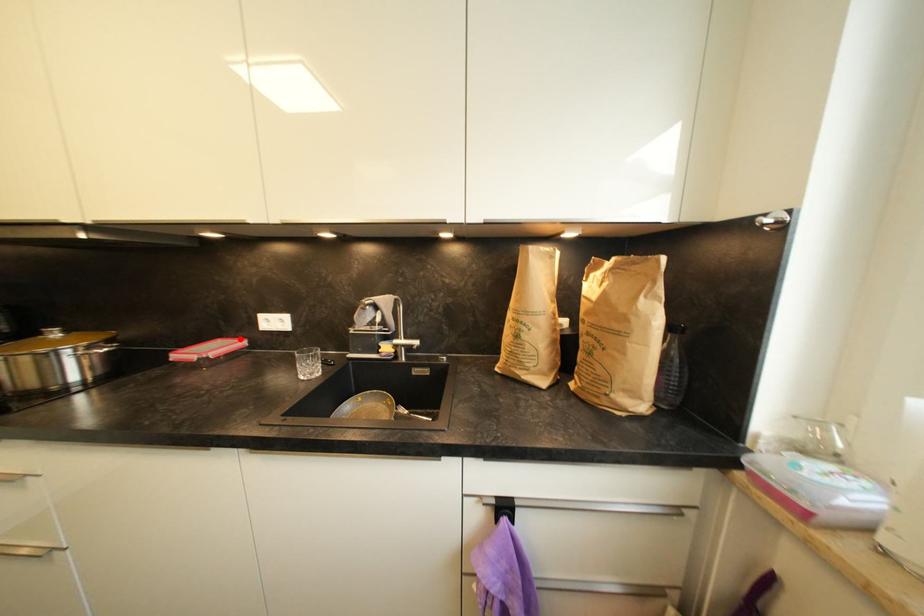
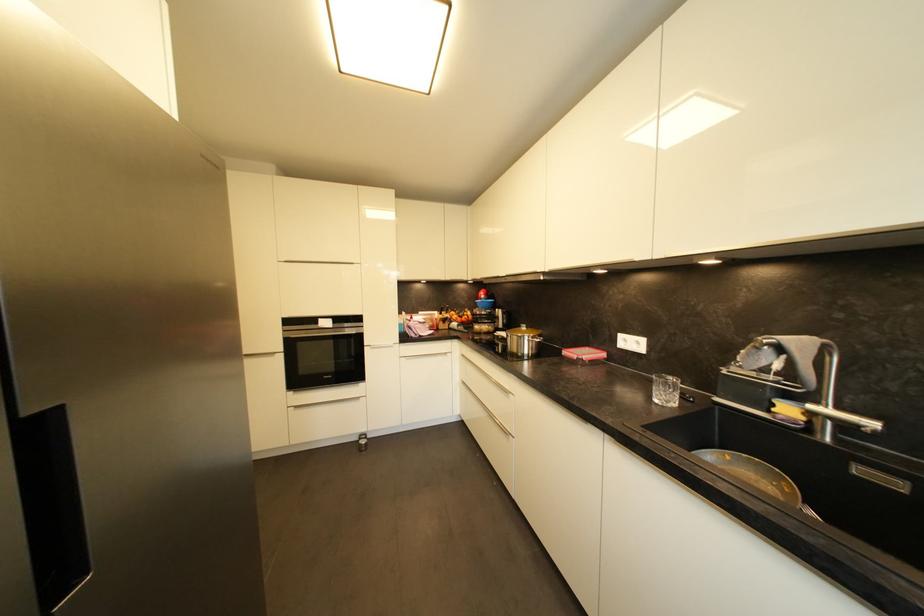
Locate, in the second image, the point that corresponds to the highlighted location in the first image.

(602, 350)